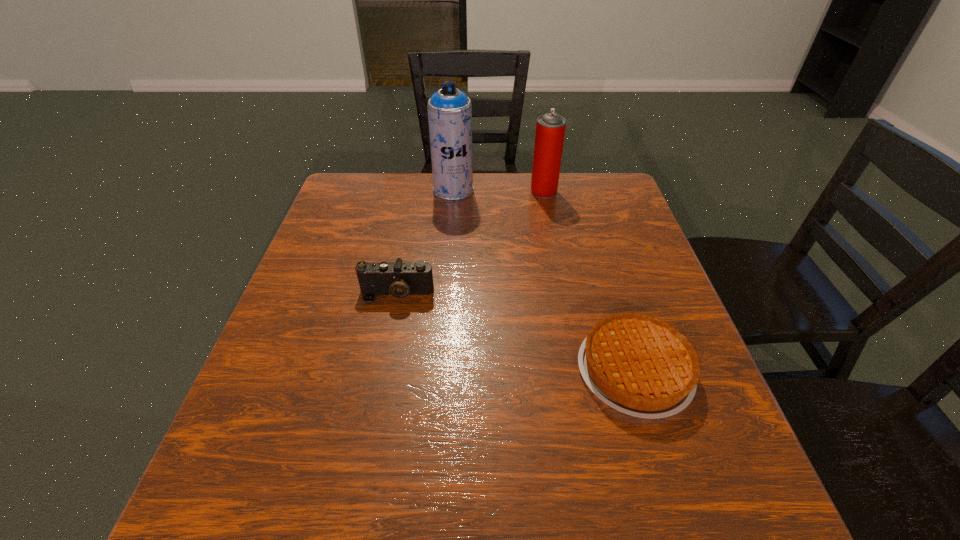
Identify which object is the closest to the nearest object. Please provide its 2D coordinates. Your answer should be formatted as a tuple, i.e. [(x, y)], where the tuple contains the x and y coordinates of a point satisfying the conditions above.

[(398, 279)]

Locate an element on the screen. Image resolution: width=960 pixels, height=540 pixels. vacant position in the image that satisfies the following two spatial constraints: 1. on the front-facing side of the shortest object; 2. on the left side of the third tallest object is located at coordinates (382, 370).

The width and height of the screenshot is (960, 540). Identify the location of free space that satisfies the following two spatial constraints: 1. on the front side of the nearest object; 2. on the right side of the taller aerosol can. (439, 370).